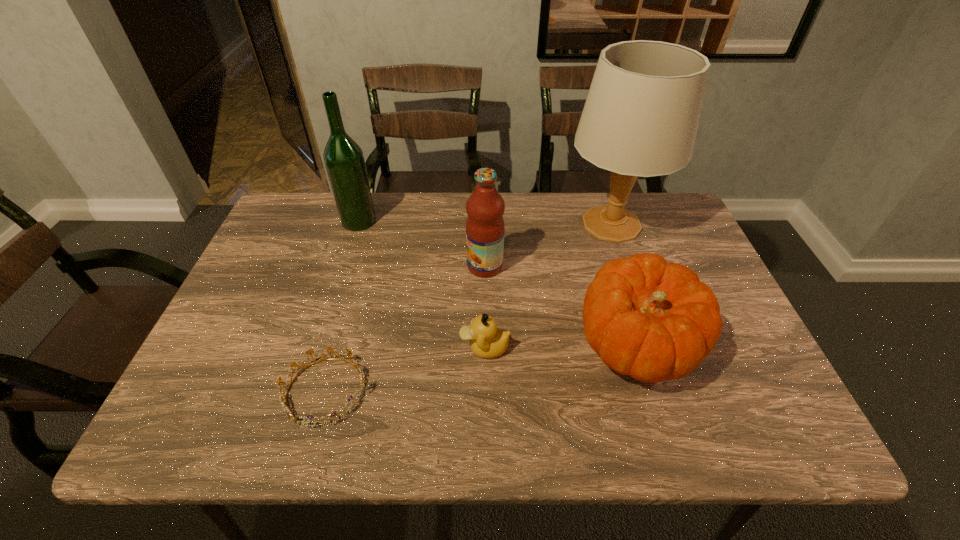
Where is `free region located on the front label of the third tallest object`? free region located on the front label of the third tallest object is located at coordinates (407, 266).

This screenshot has height=540, width=960. I want to click on free location located 0.160m on the left of the pumpkin, so click(506, 345).

What are the coordinates of `vacant space located on the face of the duckling` in the screenshot? It's located at (372, 348).

This screenshot has height=540, width=960. I want to click on blank space located 0.280m on the face of the duckling, so click(337, 348).

At what (x,y) coordinates should I click in order to perform the action: click on free point located on the face of the duckling. Please return your answer as a coordinate pair (x, y). This screenshot has height=540, width=960. Looking at the image, I should click on [305, 348].

At what (x,y) coordinates should I click in order to perform the action: click on free location located 0.290m on the front-facing side of the tiara. Please return your answer as a coordinate pair (x, y). The image size is (960, 540). Looking at the image, I should click on (506, 391).

The height and width of the screenshot is (540, 960). I want to click on table lamp that is at the far edge, so click(x=641, y=115).

Where is `alcohol positioned at the far edge`? The height and width of the screenshot is (540, 960). alcohol positioned at the far edge is located at coordinates (344, 160).

You are a GUI agent. You are given a task and a screenshot of the screen. Output one action in this format:
    pyautogui.click(x=<x>, y=<y>)
    Task: Click on the object at the near edge
    This screenshot has height=540, width=960.
    Given the screenshot: What is the action you would take?
    pyautogui.click(x=284, y=403)

Where is `table lamp that is at the right edge`? The image size is (960, 540). table lamp that is at the right edge is located at coordinates (641, 115).